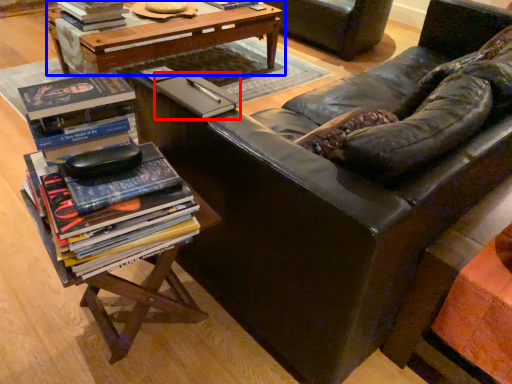
Question: Which object is further to the camera taking this photo, paperback book (highlighted by a red box) or table (highlighted by a blue box)?

Choices:
 (A) paperback book
 (B) table

Answer: (B)